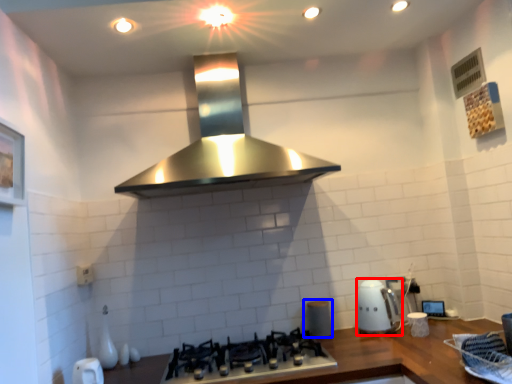
Question: Which of the following is the farthest to the observer, kitchen appliance (highlighted by a red box) or appliance (highlighted by a blue box)?

Choices:
 (A) kitchen appliance
 (B) appliance

Answer: (B)